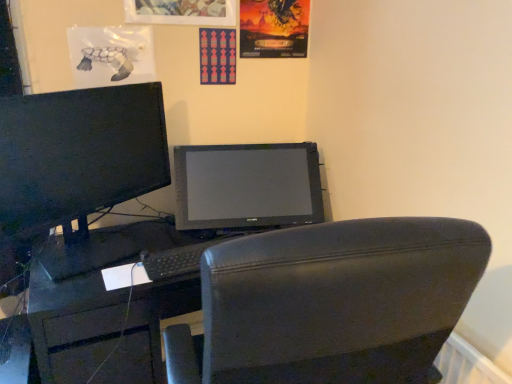
Question: Is black matte keyboard at center oriented away from black leather chair at center?

Choices:
 (A) no
 (B) yes

Answer: (A)

Question: Could you tell me if black matte keyboard at center is turned towards black leather chair at center?

Choices:
 (A) yes
 (B) no

Answer: (A)

Question: Is black leather chair at center a part of black matte keyboard at center?

Choices:
 (A) no
 (B) yes

Answer: (A)

Question: Considering the relative sizes of black matte keyboard at center and black leather chair at center in the image provided, is black matte keyboard at center bigger than black leather chair at center?

Choices:
 (A) no
 (B) yes

Answer: (A)

Question: Can you confirm if black matte keyboard at center is shorter than black leather chair at center?

Choices:
 (A) no
 (B) yes

Answer: (B)

Question: Based on their sizes in the image, would you say matte pink poster at upper center, which is the first poster page from left to right, is bigger or smaller than black matte keyboard at center?

Choices:
 (A) big
 (B) small

Answer: (B)

Question: Is matte pink poster at upper center, which is the first poster page from left to right, in front of or behind black matte keyboard at center in the image?

Choices:
 (A) front
 (B) behind

Answer: (B)

Question: Would you say matte pink poster at upper center, marked as the 2th poster page in a right-to-left arrangement, is inside or outside black matte keyboard at center?

Choices:
 (A) inside
 (B) outside

Answer: (B)

Question: Would you say matte pink poster at upper center, marked as the 2th poster page in a right-to-left arrangement, is to the left or to the right of black matte keyboard at center in the picture?

Choices:
 (A) right
 (B) left

Answer: (A)

Question: Is point (222, 372) positioned closer to the camera than point (81, 109)?

Choices:
 (A) farther
 (B) closer

Answer: (B)

Question: Based on their positions, is black leather chair at center located to the left or right of matte black monitor at left?

Choices:
 (A) right
 (B) left

Answer: (A)

Question: Is black leather chair at center wider or thinner than matte black monitor at left?

Choices:
 (A) wide
 (B) thin

Answer: (A)

Question: Is black leather chair at center in front of or behind matte black monitor at left in the image?

Choices:
 (A) behind
 (B) front

Answer: (B)

Question: Considering the positions of matte black monitor at left and black matte keyboard at center in the image, is matte black monitor at left wider or thinner than black matte keyboard at center?

Choices:
 (A) wide
 (B) thin

Answer: (A)

Question: Is matte black monitor at left to the left or to the right of black matte keyboard at center in the image?

Choices:
 (A) right
 (B) left

Answer: (B)